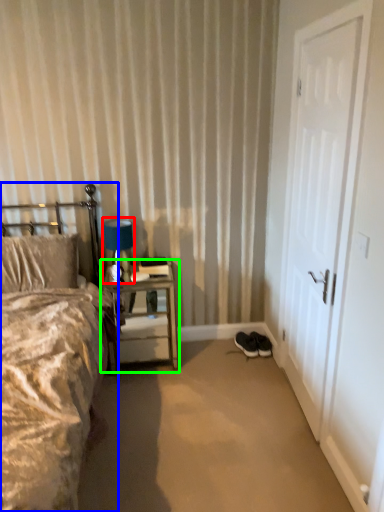
Question: Which object is the closest to the table lamp (highlighted by a red box)? Choose among these: bed (highlighted by a blue box) or nightstand (highlighted by a green box).

Choices:
 (A) bed
 (B) nightstand

Answer: (B)